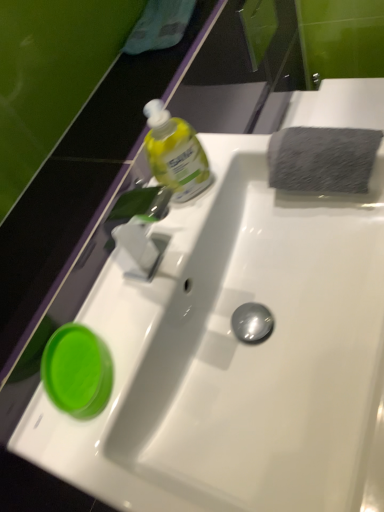
This screenshot has width=384, height=512. I want to click on blank space to the left of translucent yellow liquid at upper center, so click(139, 254).